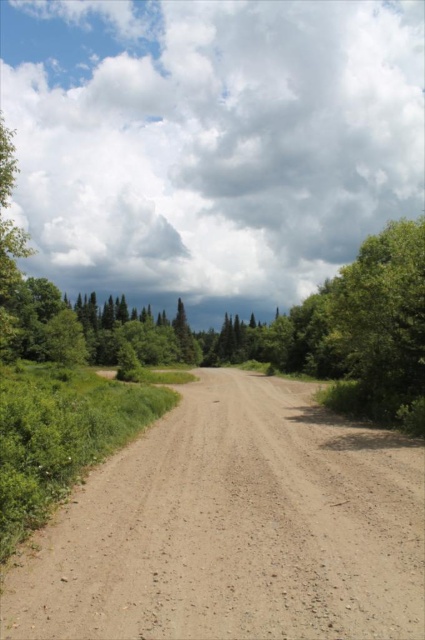
Is brown gravel dirt track at center thinner than green leafy tree at right?

In fact, brown gravel dirt track at center might be wider than green leafy tree at right.

Between brown gravel dirt track at center and green leafy tree at right, which one has less height?

brown gravel dirt track at center is shorter.

This screenshot has width=425, height=640. In order to click on brown gravel dirt track at center in this screenshot , I will do `click(234, 528)`.